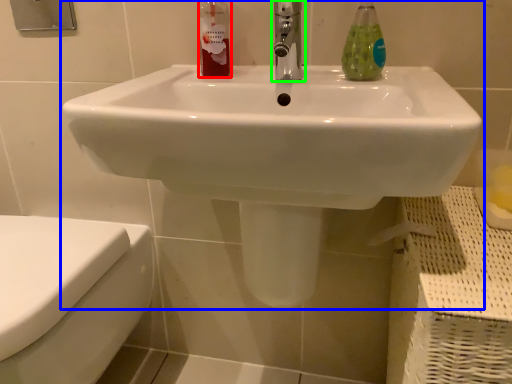
Question: Considering the real-world distances, which object is farthest from cleaning product (highlighted by a red box)? sink (highlighted by a blue box) or tap (highlighted by a green box)?

Choices:
 (A) sink
 (B) tap

Answer: (A)